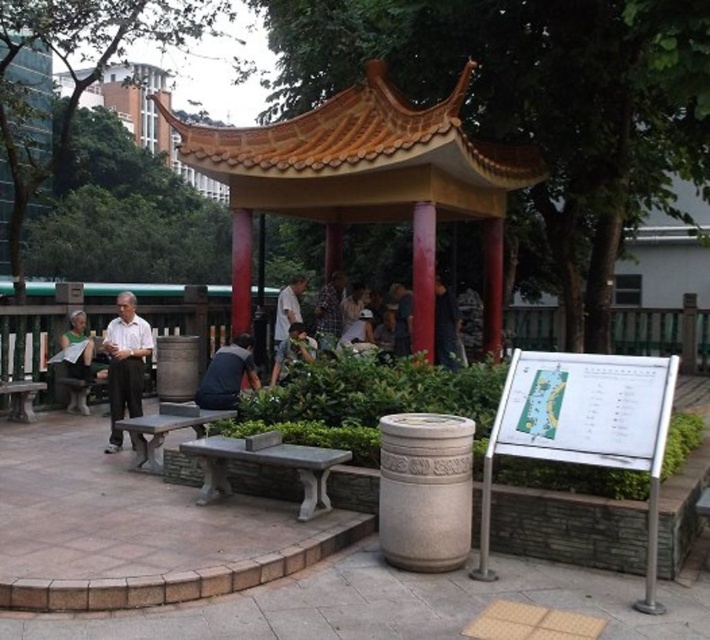
Is point (121, 336) positioned behind point (222, 417)?

That is True.

The height and width of the screenshot is (640, 710). Identify the location of white matte shirt at center. (125, 364).

Find the location of a particular element. white matte shirt at center is located at coordinates (125, 364).

Can you confirm if smooth gray bench at center is positioned to the left of smooth gray stone bench at lower left?

No, smooth gray bench at center is not to the left of smooth gray stone bench at lower left.

Is smooth gray bench at center closer to camera compared to smooth gray stone bench at lower left?

Yes, smooth gray bench at center is closer to the viewer.

Is point (202, 429) closer to viewer compared to point (18, 412)?

Yes, point (202, 429) is in front of point (18, 412).

I want to click on smooth gray bench at center, so click(163, 429).

Is matte orange gazebo at center below smooth gray stone bench at lower left?

Incorrect, matte orange gazebo at center is not positioned below smooth gray stone bench at lower left.

Can you confirm if matte orange gazebo at center is thinner than smooth gray stone bench at lower left?

No.

Which is behind, point (327, 156) or point (27, 413)?

Positioned behind is point (27, 413).

Identify the location of matte orange gazebo at center. (368, 168).